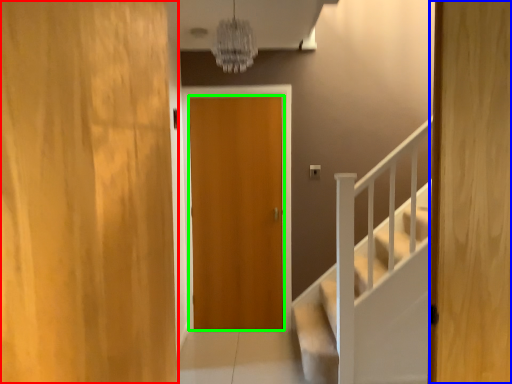
Question: Which object is the farthest from door (highlighted by a red box)? Choose among these: door (highlighted by a blue box) or door (highlighted by a green box).

Choices:
 (A) door
 (B) door

Answer: (B)